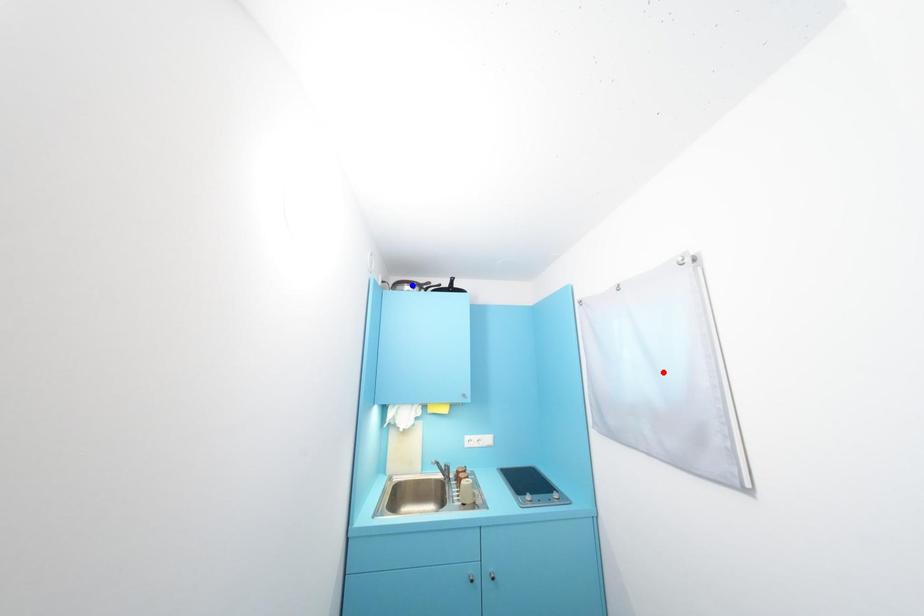
Question: Two points are marked on the image. Which point is closer to the camera?

Choices:
 (A) Blue point is closer.
 (B) Red point is closer.

Answer: (B)